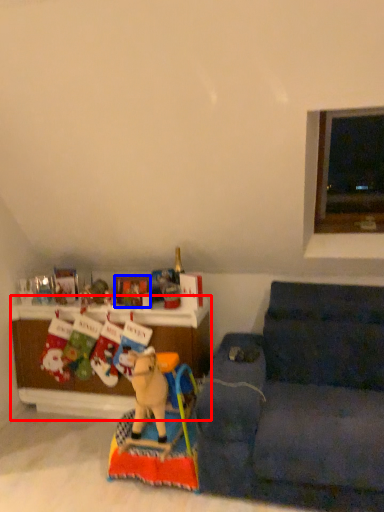
Question: Among these objects, which one is nearest to the camera, cabinetry (highlighted by a red box) or picture frame (highlighted by a blue box)?

Choices:
 (A) cabinetry
 (B) picture frame

Answer: (A)